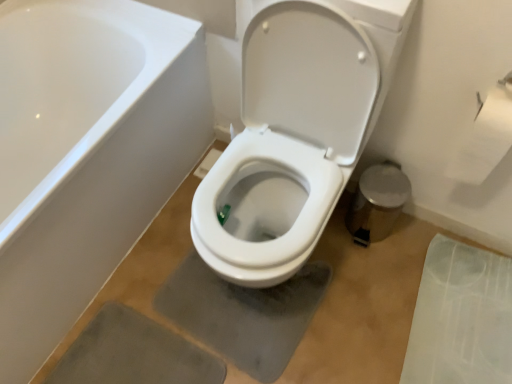
Question: Is transparent plastic mat at lower right turned away from white paper at upper right?

Choices:
 (A) no
 (B) yes

Answer: (A)

Question: From the image's perspective, is transparent plastic mat at lower right under white paper at upper right?

Choices:
 (A) no
 (B) yes

Answer: (B)

Question: Is white paper at upper right a part of transparent plastic mat at lower right?

Choices:
 (A) yes
 (B) no

Answer: (B)

Question: Can you confirm if transparent plastic mat at lower right is positioned to the right of white paper at upper right?

Choices:
 (A) yes
 (B) no

Answer: (A)

Question: Is transparent plastic mat at lower right closer to camera compared to white paper at upper right?

Choices:
 (A) no
 (B) yes

Answer: (A)

Question: Is point (417, 339) positioned closer to the camera than point (333, 152)?

Choices:
 (A) farther
 (B) closer

Answer: (A)

Question: Considering the relative positions of transparent plastic mat at lower right and white glossy toilet at center in the image provided, is transparent plastic mat at lower right to the left or to the right of white glossy toilet at center?

Choices:
 (A) left
 (B) right

Answer: (B)

Question: Is transparent plastic mat at lower right taller or shorter than white glossy toilet at center?

Choices:
 (A) short
 (B) tall

Answer: (A)

Question: Is transparent plastic mat at lower right spatially inside white glossy toilet at center, or outside of it?

Choices:
 (A) inside
 (B) outside

Answer: (B)

Question: Considering the positions of white glossy toilet at center and transparent plastic mat at lower right in the image, is white glossy toilet at center taller or shorter than transparent plastic mat at lower right?

Choices:
 (A) tall
 (B) short

Answer: (A)

Question: Looking at their shapes, would you say white glossy toilet at center is wider or thinner than transparent plastic mat at lower right?

Choices:
 (A) thin
 (B) wide

Answer: (B)

Question: Is point (332, 99) positioned closer to the camera than point (499, 289)?

Choices:
 (A) closer
 (B) farther

Answer: (A)

Question: Considering their positions, is white glossy toilet at center located in front of or behind transparent plastic mat at lower right?

Choices:
 (A) behind
 (B) front

Answer: (B)

Question: Looking at their shapes, would you say white glossy toilet at center is wider or thinner than white paper at upper right?

Choices:
 (A) wide
 (B) thin

Answer: (A)

Question: Considering the positions of point pyautogui.click(x=263, y=254) and point pyautogui.click(x=497, y=134), is point pyautogui.click(x=263, y=254) closer or farther from the camera than point pyautogui.click(x=497, y=134)?

Choices:
 (A) farther
 (B) closer

Answer: (B)